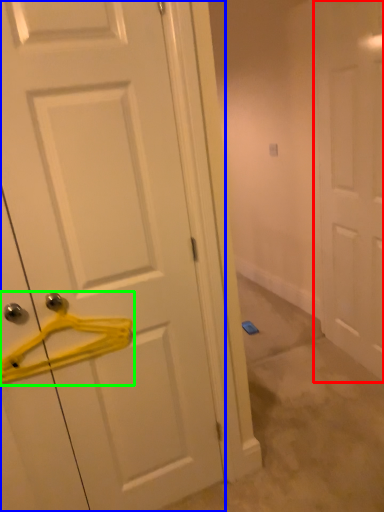
Question: Based on their relative distances, which object is farther from door (highlighted by a red box)? Choose from door (highlighted by a blue box) and hanger (highlighted by a green box).

Choices:
 (A) door
 (B) hanger

Answer: (B)